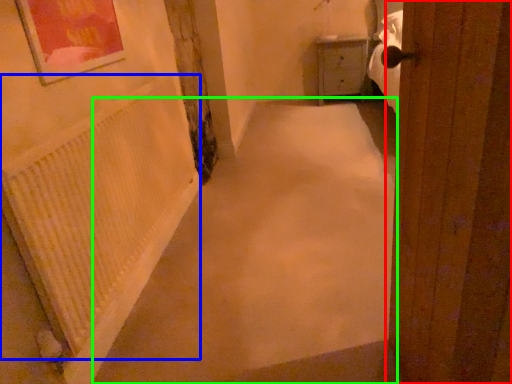
Question: Which object is positioned farthest from door (highlighted by a red box)? Select from radiator (highlighted by a blue box) and alley (highlighted by a green box).

Choices:
 (A) radiator
 (B) alley

Answer: (A)